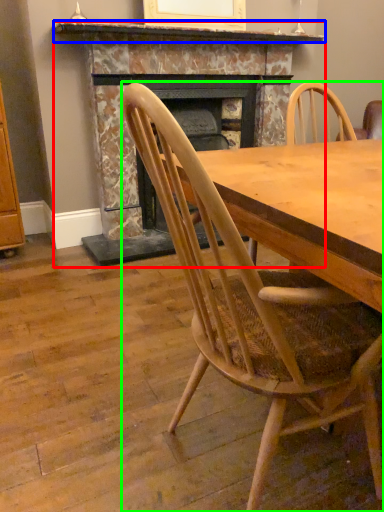
Question: Based on their relative distances, which object is farther from fireplace (highlighted by a red box)? Choose from mantle (highlighted by a blue box) and chair (highlighted by a green box).

Choices:
 (A) mantle
 (B) chair

Answer: (B)